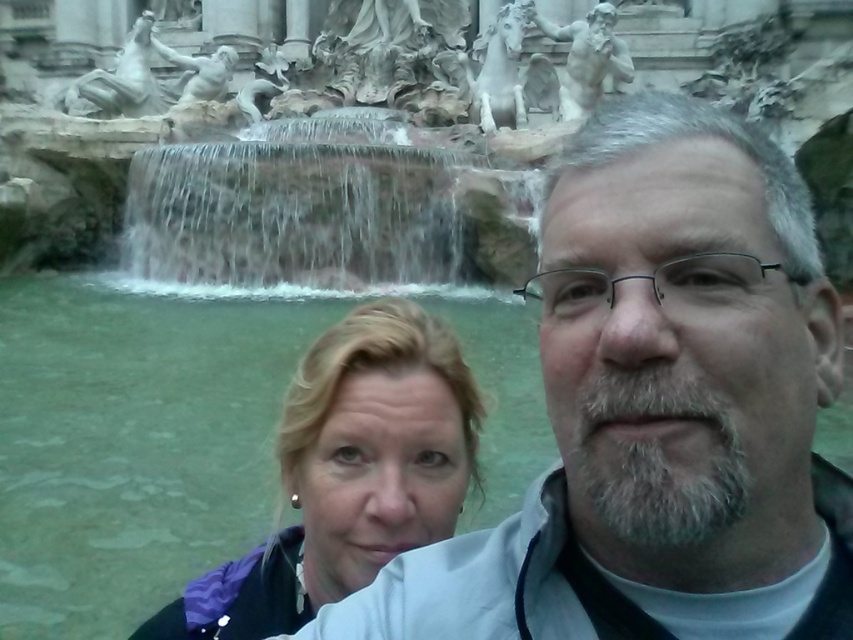
Question: Can you confirm if gray hair at center is wider than rustic stone waterfall at center?

Choices:
 (A) no
 (B) yes

Answer: (A)

Question: Which object is farther from the camera taking this photo?

Choices:
 (A) gray hair at center
 (B) blonde hair at center

Answer: (B)

Question: Which of the following is the closest to the observer?

Choices:
 (A) blonde hair at center
 (B) gray hair at center

Answer: (B)

Question: Can you confirm if gray hair at center is positioned below blonde hair at center?

Choices:
 (A) yes
 (B) no

Answer: (B)

Question: Which object appears closest to the camera in this image?

Choices:
 (A) rustic stone waterfall at center
 (B) gray hair at center
 (C) blonde hair at center

Answer: (B)

Question: Is gray hair at center above blonde hair at center?

Choices:
 (A) yes
 (B) no

Answer: (A)